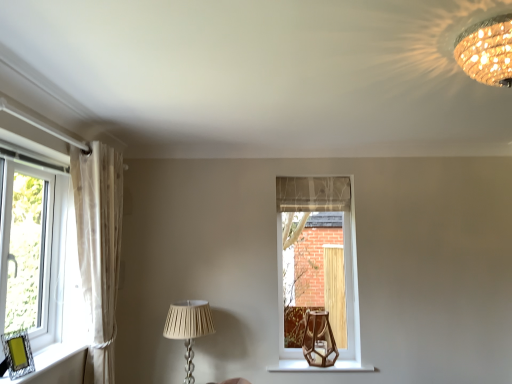
Question: From the image's perspective, is white pleated fabric lampshade at lower center, marked as the second lamp in a right-to-left arrangement, located above clear glass window at left, which is the second window in back-to-front order?

Choices:
 (A) no
 (B) yes

Answer: (A)

Question: From the image's perspective, is white pleated fabric lampshade at lower center, marked as the second lamp in a right-to-left arrangement, under clear glass window at left, which ranks as the first window in left-to-right order?

Choices:
 (A) no
 (B) yes

Answer: (B)

Question: Is white pleated fabric lampshade at lower center, marked as the second lamp in a right-to-left arrangement, wider than clear glass window at left, which is the second window in back-to-front order?

Choices:
 (A) yes
 (B) no

Answer: (A)

Question: Is the depth of white pleated fabric lampshade at lower center, arranged as the 2th lamp when viewed from the top, greater than that of clear glass window at left, the 1th window from the front?

Choices:
 (A) yes
 (B) no

Answer: (A)

Question: From a real-world perspective, is white pleated fabric lampshade at lower center, arranged as the second lamp when viewed from the front, under clear glass window at left, placed as the 2th window when sorted from right to left?

Choices:
 (A) yes
 (B) no

Answer: (A)

Question: Does white pleated fabric lampshade at lower center, marked as the second lamp in a right-to-left arrangement, have a lesser height compared to clear glass window at left, which ranks as the first window in left-to-right order?

Choices:
 (A) no
 (B) yes

Answer: (B)

Question: Considering the relative sizes of gold textured chandelier at upper right, positioned as the first lamp in right-to-left order, and sheer white curtain at left in the image provided, is gold textured chandelier at upper right, positioned as the first lamp in right-to-left order, shorter than sheer white curtain at left?

Choices:
 (A) yes
 (B) no

Answer: (A)

Question: From a real-world perspective, is gold textured chandelier at upper right, marked as the 2th lamp in a left-to-right arrangement, below sheer white curtain at left?

Choices:
 (A) yes
 (B) no

Answer: (B)

Question: Is gold textured chandelier at upper right, marked as the 2th lamp in a left-to-right arrangement, to the right of sheer white curtain at left from the viewer's perspective?

Choices:
 (A) yes
 (B) no

Answer: (A)

Question: From the image's perspective, is gold textured chandelier at upper right, which appears as the 2th lamp when ordered from the bottom, on top of sheer white curtain at left?

Choices:
 (A) yes
 (B) no

Answer: (A)

Question: Considering the relative sizes of gold textured chandelier at upper right, marked as the 2th lamp in a left-to-right arrangement, and sheer white curtain at left in the image provided, is gold textured chandelier at upper right, marked as the 2th lamp in a left-to-right arrangement, bigger than sheer white curtain at left?

Choices:
 (A) no
 (B) yes

Answer: (A)

Question: From the image's perspective, is gold textured chandelier at upper right, the 2th lamp when ordered from back to front, under sheer white curtain at left?

Choices:
 (A) no
 (B) yes

Answer: (A)

Question: From a real-world perspective, is clear glass window at left, which is the second window in back-to-front order, positioned under brown glass table lamp at center based on gravity?

Choices:
 (A) no
 (B) yes

Answer: (A)